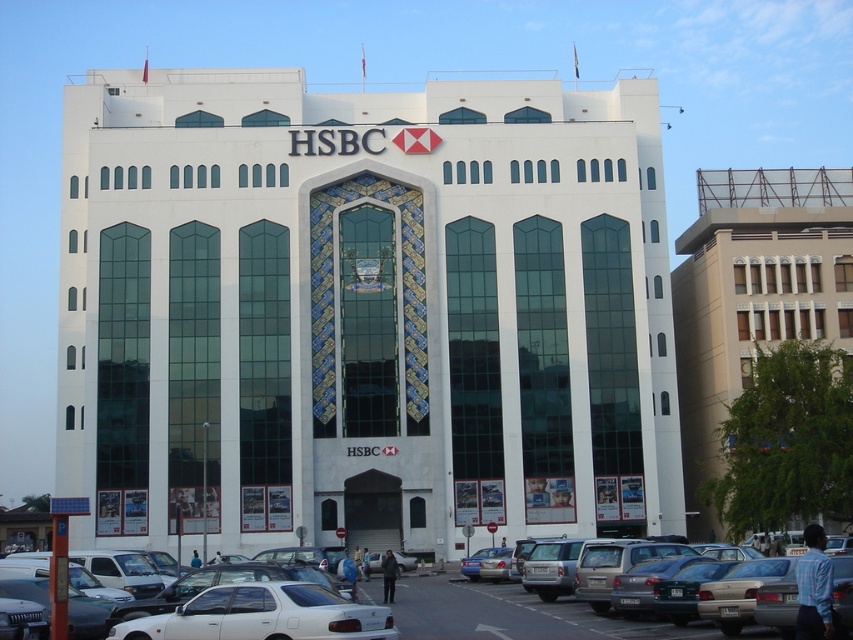
Does white glossy sedan at center lie in front of silver metallic sedan at lower center?

That is True.

From the picture: Can you confirm if white glossy sedan at center is smaller than silver metallic sedan at lower center?

Correct, white glossy sedan at center occupies less space than silver metallic sedan at lower center.

Is point (366, 621) in front of point (453, 605)?

Yes, point (366, 621) is closer to viewer.

Image resolution: width=853 pixels, height=640 pixels. Identify the location of white glossy sedan at center. (263, 616).

Between point (556, 618) and point (599, 627), which one is positioned in front?

Positioned in front is point (599, 627).

Based on the photo, does white matte cars at lower center appear over silver metallic sedan at lower center?

Yes, white matte cars at lower center is above silver metallic sedan at lower center.

Between point (512, 636) and point (503, 596), which one is positioned in front?

Point (512, 636)

The width and height of the screenshot is (853, 640). I want to click on white matte cars at lower center, so click(515, 614).

Between white glossy sedan at center and white matte sedan at lower center, which one appears on the right side from the viewer's perspective?

Positioned to the right is white glossy sedan at center.

Locate an element on the screen. white glossy sedan at center is located at coordinates (263, 616).

Between point (223, 605) and point (144, 600), which one is positioned in front?

Point (223, 605)

This screenshot has width=853, height=640. I want to click on white glossy sedan at center, so click(x=263, y=616).